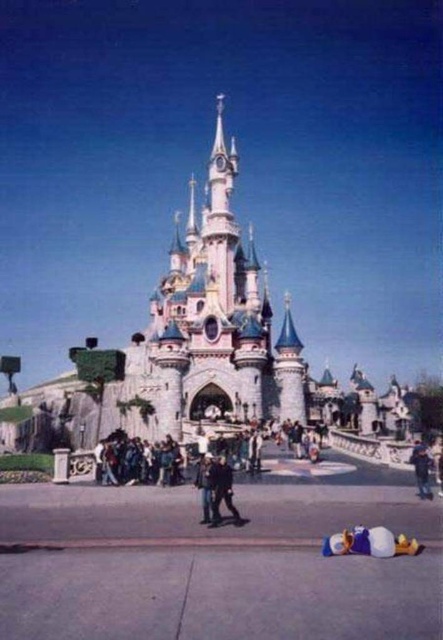
In the scene shown: Does dark blue jeans at center have a smaller size compared to denim pants at lower right?

Indeed, dark blue jeans at center has a smaller size compared to denim pants at lower right.

Does dark blue jeans at center appear on the right side of denim pants at lower right?

Incorrect, dark blue jeans at center is not on the right side of denim pants at lower right.

Is point (221, 470) behind point (427, 470)?

No.

Where is `dark blue jeans at center`? This screenshot has height=640, width=443. dark blue jeans at center is located at coordinates (221, 490).

Between light blue stone castle at center and dark blue jeans at center, which one has less height?

Standing shorter between the two is dark blue jeans at center.

In the scene shown: Does light blue stone castle at center have a lesser height compared to dark blue jeans at center?

Incorrect, light blue stone castle at center's height does not fall short of dark blue jeans at center's.

Does point (77, 410) lie in front of point (213, 481)?

That is False.

Identify the location of light blue stone castle at center. (205, 355).

In the scene shown: Can you confirm if light blue stone castle at center is thinner than denim pants at lower right?

No.

Identify the location of light blue stone castle at center. The image size is (443, 640). (205, 355).

Describe the element at coordinates (205, 355) in the screenshot. This screenshot has width=443, height=640. I see `light blue stone castle at center` at that location.

The image size is (443, 640). In order to click on light blue stone castle at center in this screenshot , I will do `click(205, 355)`.